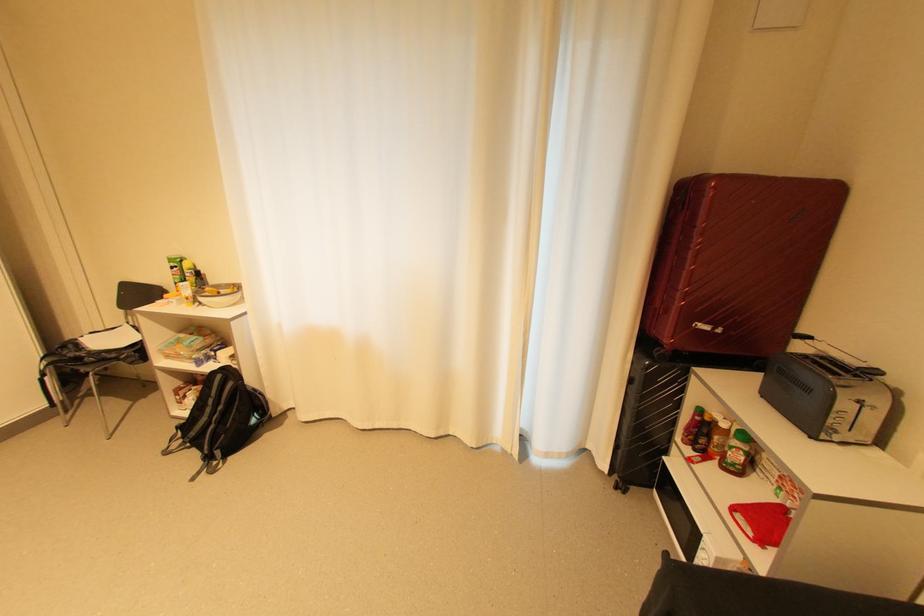
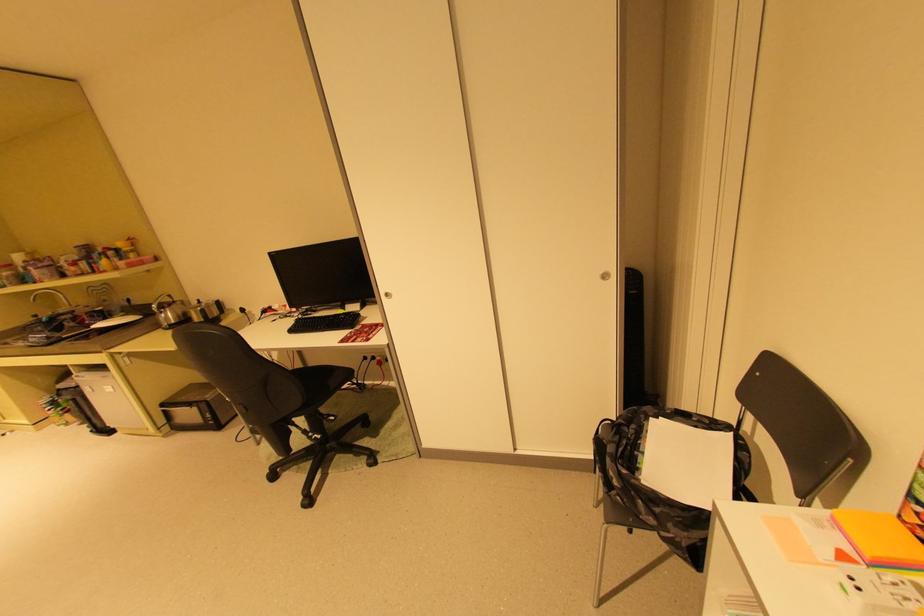
The point at (79, 346) is marked in the first image. Where is the corresponding point in the second image?

(640, 427)